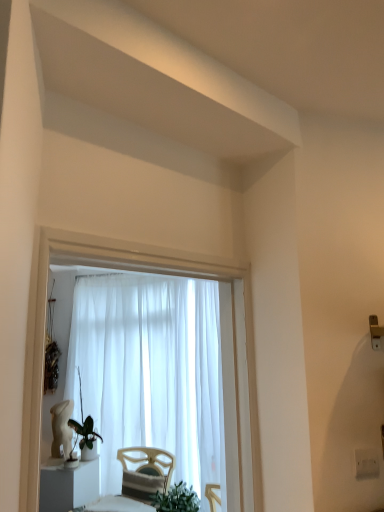
Locate an element on the screen. This screenshot has height=512, width=384. empty space that is ontop of green matte plant at lower left (from a real-world perspective) is located at coordinates (89, 418).